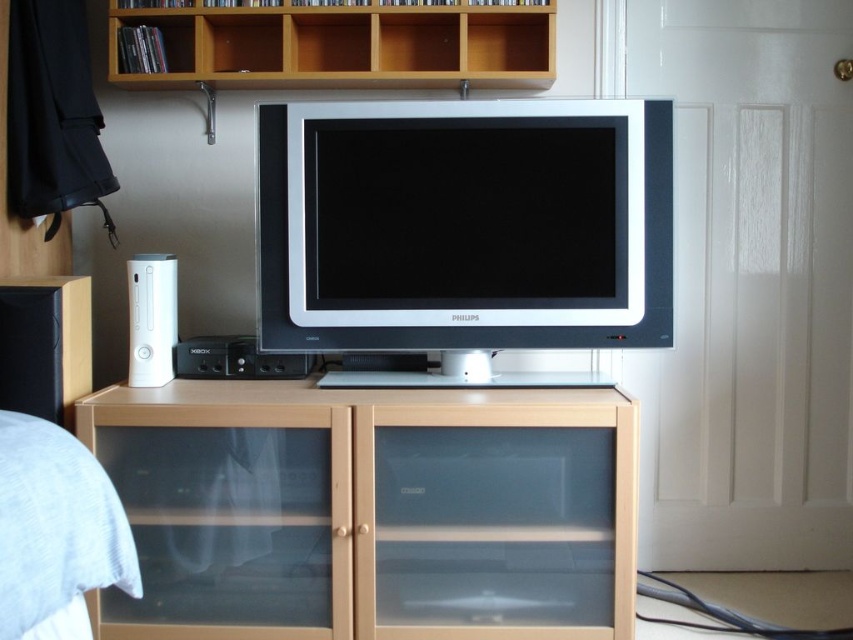
Question: Does light brown wood at upper center have a lesser width compared to black matte speaker at left?

Choices:
 (A) no
 (B) yes

Answer: (A)

Question: Which object is closer to the camera taking this photo?

Choices:
 (A) light brown wood at upper center
 (B) light brown wood cabinet at center
 (C) white glossy xbox at left

Answer: (B)

Question: Which point is closer to the camera?

Choices:
 (A) light brown wood at upper center
 (B) white glossy xbox at left

Answer: (B)

Question: Can you confirm if light brown wood at upper center is positioned to the left of black matte speaker at left?

Choices:
 (A) yes
 (B) no

Answer: (B)

Question: Among these objects, which one is nearest to the camera?

Choices:
 (A) light brown wood at upper center
 (B) white glossy xbox at left
 (C) black matte speaker at left
 (D) light brown wood cabinet at center

Answer: (C)

Question: Does light brown wood at upper center have a lesser width compared to white glossy xbox at left?

Choices:
 (A) no
 (B) yes

Answer: (A)